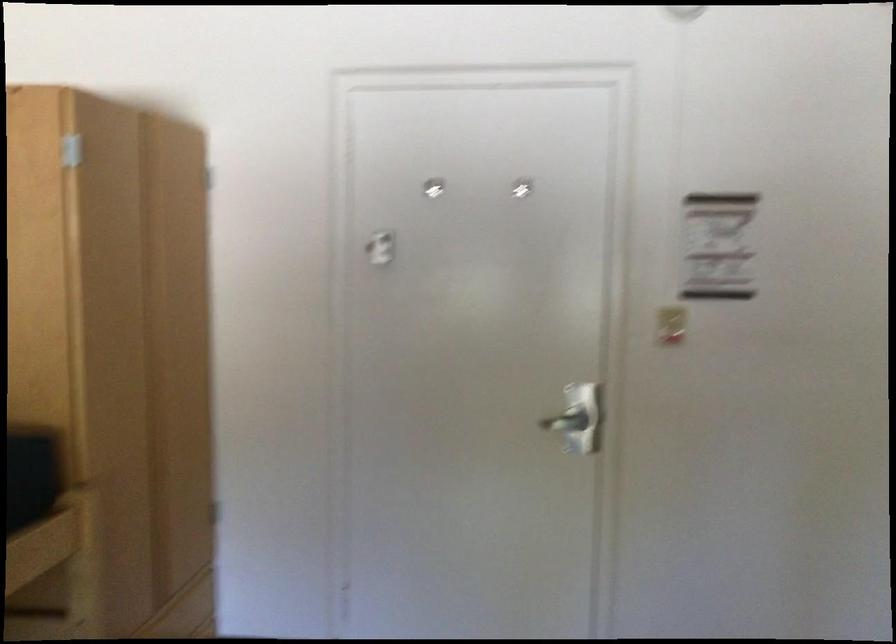
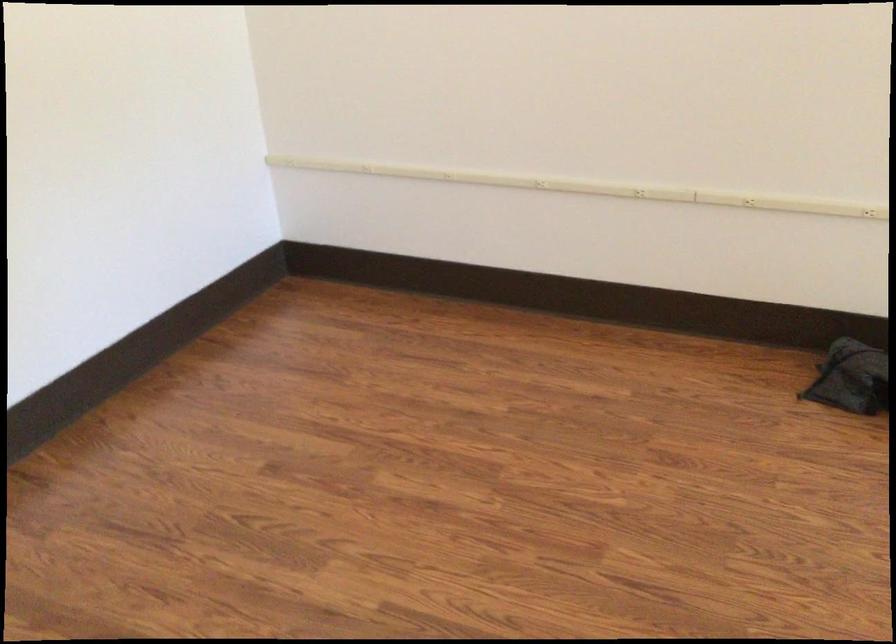
How did the camera likely rotate?

The camera's rotation is toward right-down.